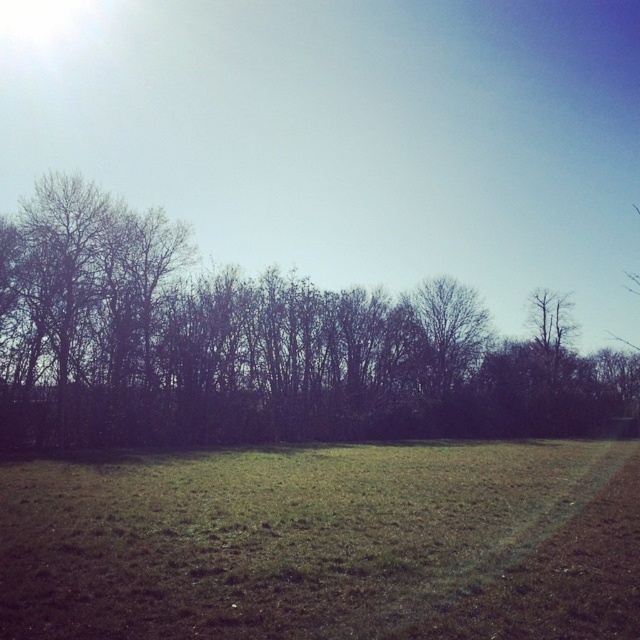
Which is above, green grass at center or dark brown leafless trees at center?

Positioned higher is dark brown leafless trees at center.

Is green grass at center closer to camera compared to dark brown leafless trees at center?

Yes, green grass at center is closer to the viewer.

Find the location of a particular element. The height and width of the screenshot is (640, 640). green grass at center is located at coordinates (324, 544).